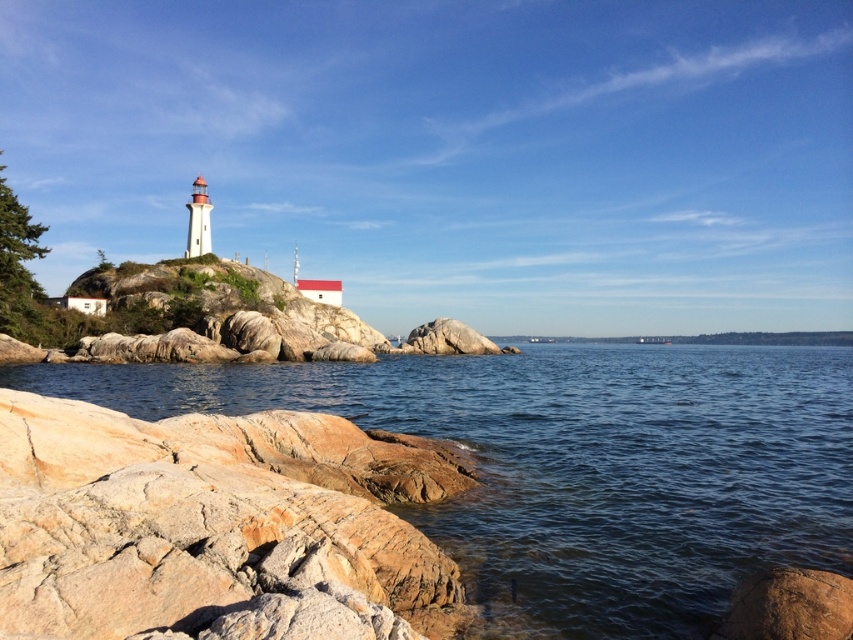
Can you confirm if clear water at lower left is smaller than brown rough rock at lower right?

No.

Does point (525, 500) come behind point (791, 608)?

Yes, point (525, 500) is behind point (791, 608).

The image size is (853, 640). I want to click on clear water at lower left, so click(x=577, y=465).

Find the location of a particular element. The height and width of the screenshot is (640, 853). clear water at lower left is located at coordinates (577, 465).